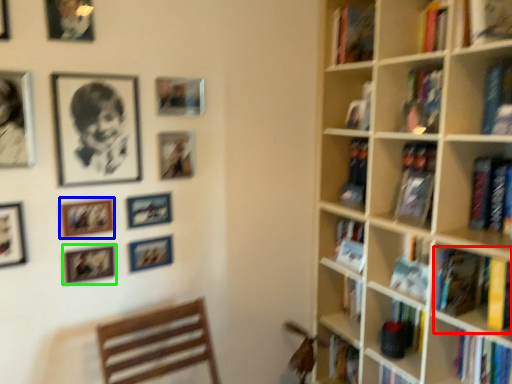
Question: Which object is positioned farthest from book (highlighted by a red box)? Select from picture frame (highlighted by a blue box) and picture frame (highlighted by a green box).

Choices:
 (A) picture frame
 (B) picture frame

Answer: (A)